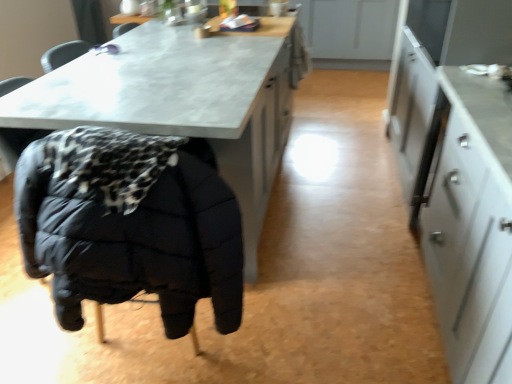
Question: Does white glossy cabinet at right come behind matte gray table at center?

Choices:
 (A) yes
 (B) no

Answer: (B)

Question: Is white glossy cabinet at right located outside matte gray table at center?

Choices:
 (A) no
 (B) yes

Answer: (B)

Question: Can you confirm if white glossy cabinet at right is smaller than matte gray table at center?

Choices:
 (A) no
 (B) yes

Answer: (B)

Question: Is white glossy cabinet at right at the right side of matte gray table at center?

Choices:
 (A) yes
 (B) no

Answer: (A)

Question: Does white glossy cabinet at right have a lesser width compared to matte gray table at center?

Choices:
 (A) no
 (B) yes

Answer: (B)

Question: From the image's perspective, is matte gray table at center above or below black quilted jacket at lower left?

Choices:
 (A) below
 (B) above

Answer: (B)

Question: Based on their sizes in the image, would you say matte gray table at center is bigger or smaller than black quilted jacket at lower left?

Choices:
 (A) big
 (B) small

Answer: (A)

Question: Considering the positions of matte gray table at center and black quilted jacket at lower left in the image, is matte gray table at center taller or shorter than black quilted jacket at lower left?

Choices:
 (A) tall
 (B) short

Answer: (A)

Question: From a real-world perspective, is matte gray table at center physically located above or below black quilted jacket at lower left?

Choices:
 (A) above
 (B) below

Answer: (B)

Question: From the image's perspective, is black quilted jacket at lower left located above or below matte gray table at center?

Choices:
 (A) below
 (B) above

Answer: (A)

Question: Relative to matte gray table at center, is black quilted jacket at lower left in front or behind?

Choices:
 (A) behind
 (B) front

Answer: (B)

Question: In terms of width, does black quilted jacket at lower left look wider or thinner when compared to matte gray table at center?

Choices:
 (A) wide
 (B) thin

Answer: (B)

Question: In terms of height, does black quilted jacket at lower left look taller or shorter compared to matte gray table at center?

Choices:
 (A) short
 (B) tall

Answer: (A)

Question: In the image, is white glossy cabinet at right on the left side or the right side of matte gray table at center?

Choices:
 (A) right
 (B) left

Answer: (A)

Question: Which is correct: white glossy cabinet at right is inside matte gray table at center, or outside of it?

Choices:
 (A) outside
 (B) inside

Answer: (A)